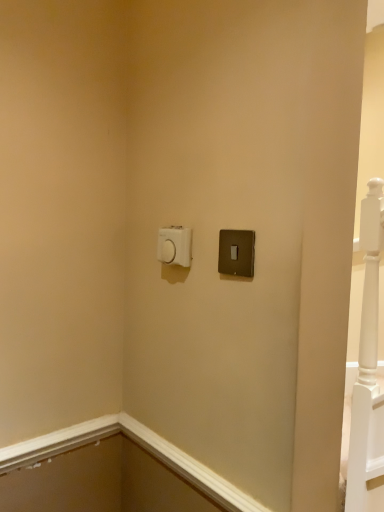
Question: Is satin black switch at upper right, which is the 2th light switch from left to right, taller or shorter than white plastic light switch at upper center, the 2th light switch positioned from the front?

Choices:
 (A) short
 (B) tall

Answer: (B)

Question: Is satin black switch at upper right, which ranks as the 1th light switch in right-to-left order, inside the boundaries of white plastic light switch at upper center, the first light switch in the back-to-front sequence, or outside?

Choices:
 (A) inside
 (B) outside

Answer: (B)

Question: Considering the relative positions of satin black switch at upper right, which ranks as the 1th light switch in right-to-left order, and white plastic light switch at upper center, the 2th light switch positioned from the front, in the image provided, is satin black switch at upper right, which ranks as the 1th light switch in right-to-left order, to the left or to the right of white plastic light switch at upper center, the 2th light switch positioned from the front,?

Choices:
 (A) right
 (B) left

Answer: (A)

Question: Is white plastic light switch at upper center, which appears as the second light switch when viewed from the right, taller or shorter than satin black switch at upper right, which ranks as the 1th light switch in right-to-left order?

Choices:
 (A) short
 (B) tall

Answer: (A)

Question: From a real-world perspective, is white plastic light switch at upper center, which appears as the second light switch when viewed from the right, positioned above or below satin black switch at upper right, placed as the 2th light switch when sorted from back to front?

Choices:
 (A) below
 (B) above

Answer: (B)

Question: Considering the positions of white plastic light switch at upper center, which appears as the second light switch when viewed from the right, and satin black switch at upper right, the 1th light switch from the front, in the image, is white plastic light switch at upper center, which appears as the second light switch when viewed from the right, wider or thinner than satin black switch at upper right, the 1th light switch from the front,?

Choices:
 (A) thin
 (B) wide

Answer: (B)

Question: Is white plastic light switch at upper center, marked as the first light switch in a left-to-right arrangement, in front of or behind satin black switch at upper right, the 1th light switch from the front, in the image?

Choices:
 (A) front
 (B) behind

Answer: (B)